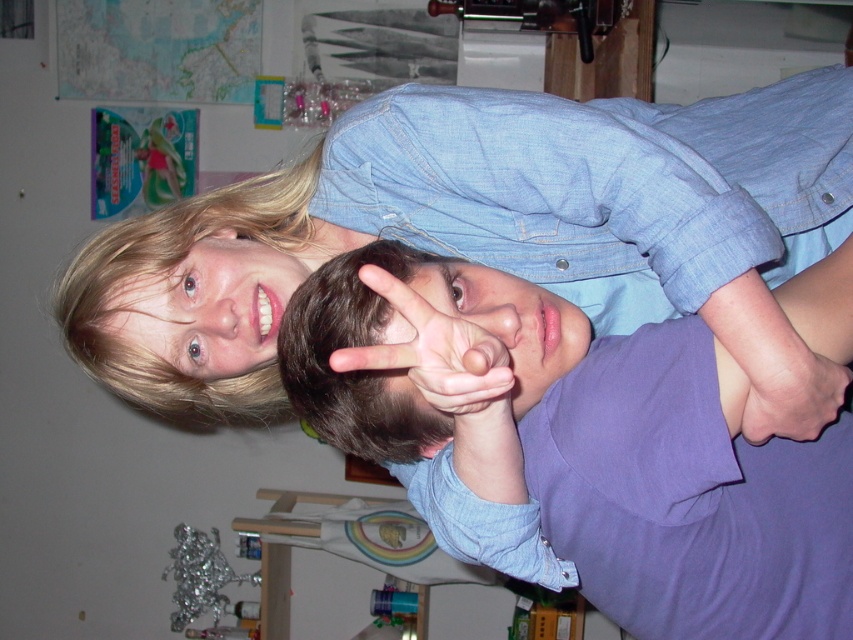
Question: Which of the following is the farthest from the observer?

Choices:
 (A) (296, 378)
 (B) (415, 136)
 (C) (834, 384)

Answer: (B)

Question: Can you confirm if blue denim shirt at upper center is positioned to the right of purple cotton shirt at center?

Choices:
 (A) yes
 (B) no

Answer: (B)

Question: Can you confirm if blue denim shirt at upper center is bigger than purple cotton shirt at center?

Choices:
 (A) yes
 (B) no

Answer: (A)

Question: Considering the relative positions of matte skin hand at center and pink flesh-toned hand at lower right in the image provided, where is matte skin hand at center located with respect to pink flesh-toned hand at lower right?

Choices:
 (A) left
 (B) right

Answer: (A)

Question: Which of these objects is positioned farthest from the purple cotton shirt at center?

Choices:
 (A) matte skin hand at center
 (B) pink flesh-toned hand at lower right

Answer: (B)

Question: Which of these objects is positioned farthest from the matte skin hand at center?

Choices:
 (A) blue denim shirt at upper center
 (B) purple cotton shirt at center
 (C) pink flesh-toned hand at lower right

Answer: (A)